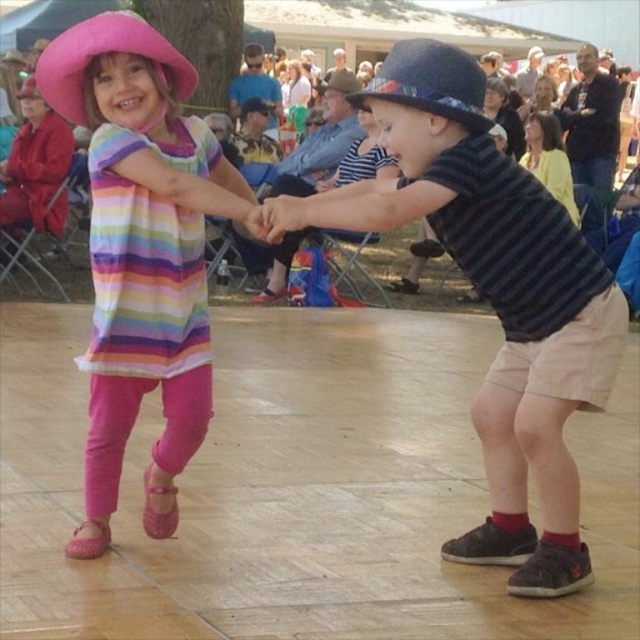
Question: Which point is closer to the camera?

Choices:
 (A) (355, 83)
 (B) (522, 308)

Answer: (B)

Question: Is striped cotton shirt at center above pink fabric cowboy hat at upper left?

Choices:
 (A) no
 (B) yes

Answer: (A)

Question: Which of these objects is positioned farthest from the pink fabric hat at upper left?

Choices:
 (A) matte pink hat at left
 (B) pink fabric cowboy hat at upper left

Answer: (B)

Question: Which point appears closest to the camera in this image?

Choices:
 (A) (22, 97)
 (B) (312, 220)
 (C) (324, 88)

Answer: (B)

Question: Is striped cotton shirt at center positioned in front of pink fabric hat at upper left?

Choices:
 (A) no
 (B) yes

Answer: (B)

Question: Does blue felt hat at center have a greater width compared to velvet blue hat at upper center?

Choices:
 (A) yes
 (B) no

Answer: (A)